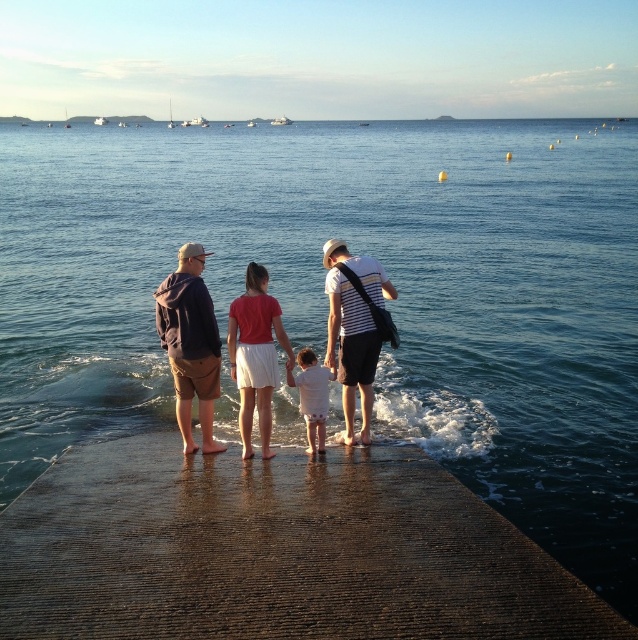
Can you confirm if dark blue hoodie at center is bigger than striped cotton shirt at center?

No, dark blue hoodie at center is not bigger than striped cotton shirt at center.

The width and height of the screenshot is (638, 640). What do you see at coordinates (189, 342) in the screenshot?
I see `dark blue hoodie at center` at bounding box center [189, 342].

The height and width of the screenshot is (640, 638). Identify the location of dark blue hoodie at center. (189, 342).

Is matte black clothing at center positioned before white cotton shirt at center?

Yes, it is.

Is point (212, 448) in front of point (315, 416)?

That is False.

Locate an element on the screen. matte black clothing at center is located at coordinates (189, 340).

Does matte black clothing at center have a greater width compared to striped cotton shirt at center?

Yes.

Is matte black clothing at center smaller than striped cotton shirt at center?

No.

Locate an element on the screen. Image resolution: width=638 pixels, height=640 pixels. matte black clothing at center is located at coordinates (189, 340).